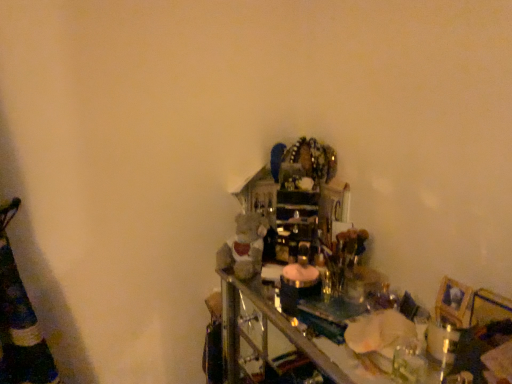
Question: Considering the positions of fuzzy fabric teddy bear at center and wooden picture frame at lower right in the image, is fuzzy fabric teddy bear at center bigger or smaller than wooden picture frame at lower right?

Choices:
 (A) big
 (B) small

Answer: (A)

Question: From a real-world perspective, is fuzzy fabric teddy bear at center positioned above or below wooden picture frame at lower right?

Choices:
 (A) below
 (B) above

Answer: (A)

Question: From the image's perspective, is fuzzy fabric teddy bear at center positioned above or below wooden picture frame at lower right?

Choices:
 (A) below
 (B) above

Answer: (B)

Question: Looking at their shapes, would you say wooden picture frame at lower right is wider or thinner than fuzzy fabric teddy bear at center?

Choices:
 (A) thin
 (B) wide

Answer: (A)

Question: Does point (442, 306) appear closer or farther from the camera than point (243, 233)?

Choices:
 (A) closer
 (B) farther

Answer: (A)

Question: Based on their positions, is wooden picture frame at lower right located to the left or right of fuzzy fabric teddy bear at center?

Choices:
 (A) right
 (B) left

Answer: (A)

Question: From a real-world perspective, is wooden picture frame at lower right above or below fuzzy fabric teddy bear at center?

Choices:
 (A) below
 (B) above

Answer: (B)